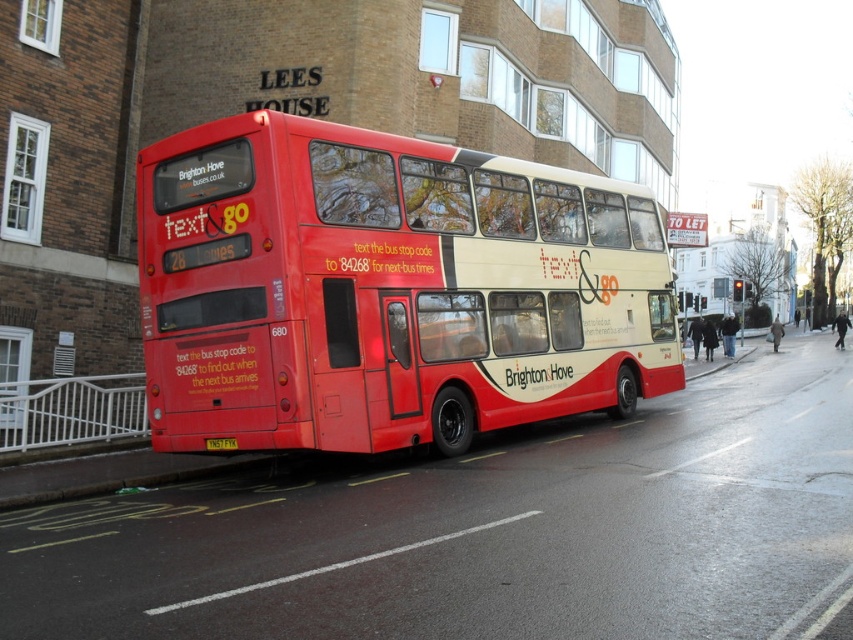
Question: Which point is closer to the camera?

Choices:
 (A) matte red bus at center
 (B) yellow metallic license plate at center

Answer: (A)

Question: Can you confirm if matte red bus at center is wider than yellow metallic license plate at center?

Choices:
 (A) yes
 (B) no

Answer: (A)

Question: Is matte red bus at center below yellow metallic license plate at center?

Choices:
 (A) yes
 (B) no

Answer: (B)

Question: Which point appears farthest from the camera in this image?

Choices:
 (A) (495, 333)
 (B) (215, 448)

Answer: (A)

Question: Is matte red bus at center above yellow metallic license plate at center?

Choices:
 (A) yes
 (B) no

Answer: (A)